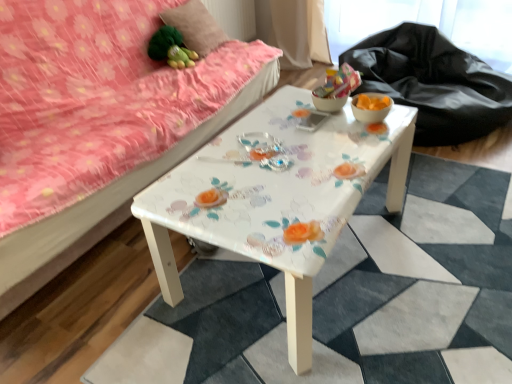
Where is `vacant space to the left of translucent glass bowl at center, acting as the first glass bowl starting from the left`? Image resolution: width=512 pixels, height=384 pixels. vacant space to the left of translucent glass bowl at center, acting as the first glass bowl starting from the left is located at coordinates point(282,112).